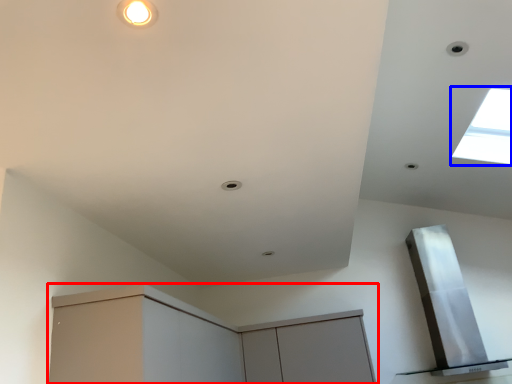
Question: Among these objects, which one is nearest to the camera, cabinetry (highlighted by a red box) or window (highlighted by a blue box)?

Choices:
 (A) cabinetry
 (B) window

Answer: (A)